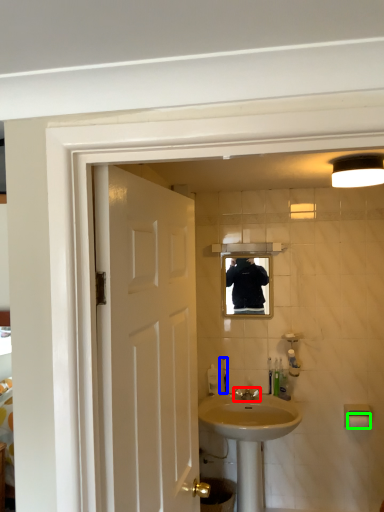
Question: Which is farther away from tap (highlighted by a red box)? toiletry (highlighted by a blue box) or towel bar (highlighted by a green box)?

Choices:
 (A) toiletry
 (B) towel bar

Answer: (B)